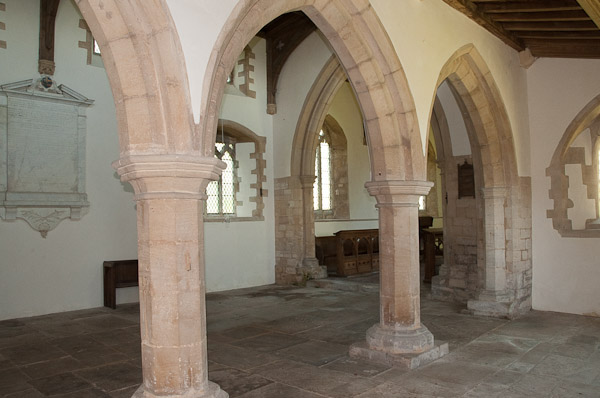
This screenshot has height=398, width=600. Identify the location of floor. (311, 355).